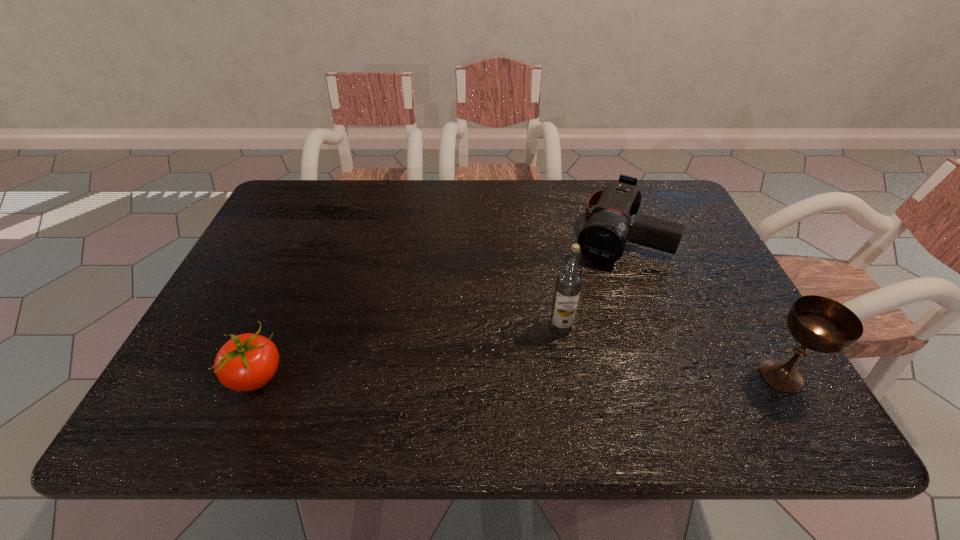
At what (x,y) coordinates should I click in order to perform the action: click on blank space located on the lens of the second object from right to left. Please return your answer as a coordinate pair (x, y). This screenshot has width=960, height=540. Looking at the image, I should click on (590, 296).

Where is `vacant region located 0.060m on the lens of the second object from right to left`? This screenshot has width=960, height=540. vacant region located 0.060m on the lens of the second object from right to left is located at coordinates (598, 280).

This screenshot has width=960, height=540. What are the coordinates of `free region located 0.120m on the label of the vodka` in the screenshot? It's located at [513, 362].

Find the location of a particular element. The width and height of the screenshot is (960, 540). free space located 0.060m on the label of the vodka is located at coordinates (533, 347).

Locate an element on the screen. free location located on the label of the vodka is located at coordinates (516, 359).

The height and width of the screenshot is (540, 960). I want to click on object at the far edge, so click(603, 239).

Locate an element on the screen. The width and height of the screenshot is (960, 540). tomato located in the near edge section of the desktop is located at coordinates (247, 362).

You are a GUI agent. You are given a task and a screenshot of the screen. Output one action in this format:
    pyautogui.click(x=<x>, y=<y>)
    Task: Click on the chalice located in the near edge section of the desktop
    The width and height of the screenshot is (960, 540).
    Given the screenshot: What is the action you would take?
    pyautogui.click(x=821, y=324)

The image size is (960, 540). Find the location of `object that is at the left edge`. object that is at the left edge is located at coordinates (247, 362).

What are the coordinates of `chalice present at the right edge` in the screenshot? It's located at (821, 324).